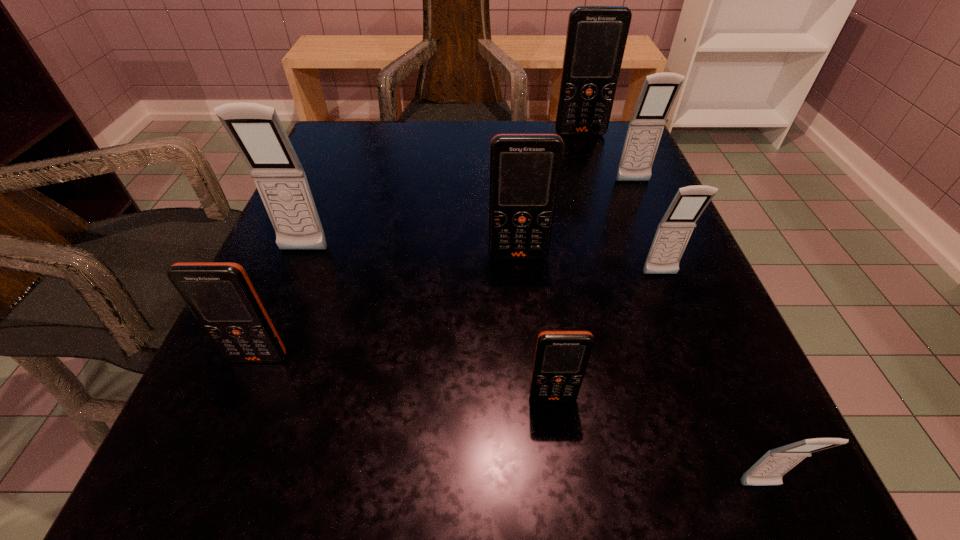
You are a GUI agent. You are given a task and a screenshot of the screen. Output one action in this format:
    pyautogui.click(x=<x>, y=<y>)
    Task: Click on the second nearest orange cellular telephone
    
    Given the screenshot: What is the action you would take?
    pyautogui.click(x=220, y=295)

Where is `the second nearest object`? Image resolution: width=960 pixels, height=540 pixels. the second nearest object is located at coordinates (561, 357).

The width and height of the screenshot is (960, 540). What are the coordinates of `the seventh farthest cellular telephone` in the screenshot? It's located at (561, 357).

You are a GUI agent. You are given a task and a screenshot of the screen. Output one action in this format:
    pyautogui.click(x=<x>, y=<y>)
    Task: Click on the nearest cellular telephone
    The image size is (960, 540).
    Given the screenshot: What is the action you would take?
    pyautogui.click(x=769, y=469)

Identify the location of the nearest gray cellular telephone. The width and height of the screenshot is (960, 540). (769, 469).

Identify the location of blank space located on the screen of the farthest object. This screenshot has height=540, width=960. (590, 165).

I want to click on vacant region located 0.060m on the front-facing side of the biggest gray cellular telephone, so click(290, 284).

Identify the location of free spot located on the front-facing side of the third smallest gray cellular telephone. point(674,278).

The height and width of the screenshot is (540, 960). Find the location of `free region located on the screen of the third nearest orange cellular telephone`. free region located on the screen of the third nearest orange cellular telephone is located at coordinates (525, 334).

Where is `free point located on the front-facing side of the fifth farthest object`? The width and height of the screenshot is (960, 540). free point located on the front-facing side of the fifth farthest object is located at coordinates (733, 461).